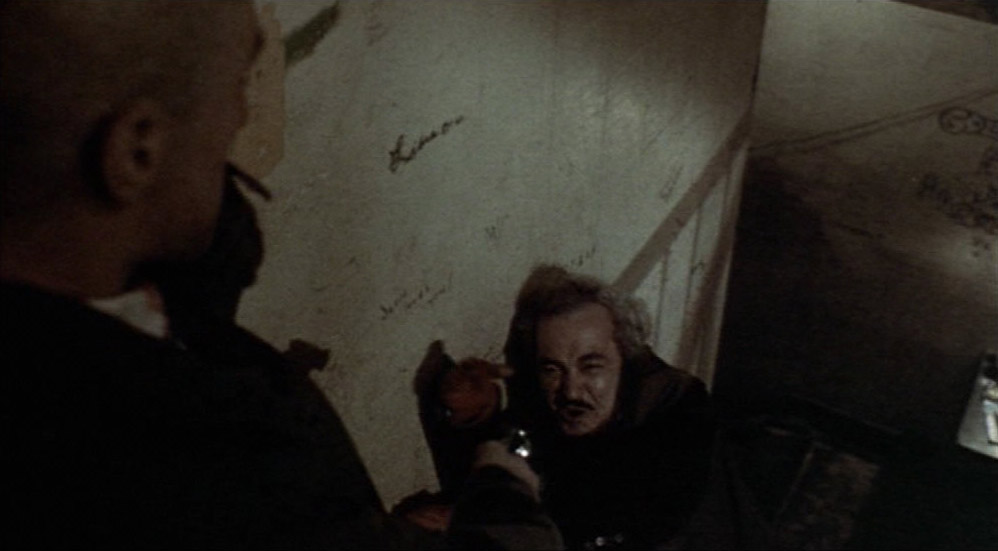
This screenshot has width=998, height=551. I want to click on signature on wall, so click(429, 140), click(160, 431).